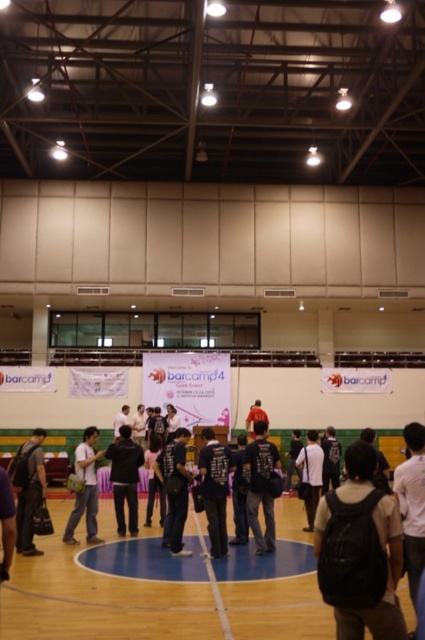
You are organizing a sports event and need to arrange participants from left to right based on their positions. If you see the dark gray backpack at left and the dark blue shirt at center, which object should be placed first from the left side?

The dark gray backpack at left should be placed first from the left side because it is positioned to the left of the dark blue shirt at center.

You are standing in the sports hall and notice two points marked on the floor. The first point is at coordinate point(x=28, y=552) and the second is at point(x=173, y=532). Which point is closer to you?

Point(x=28, y=552) is closer to the viewer than point(x=173, y=532).